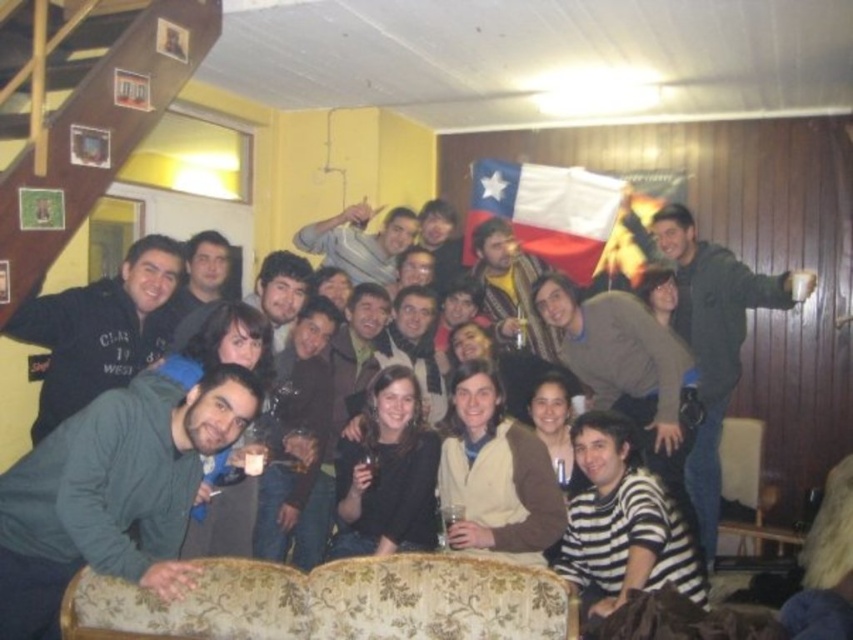
Does dark gray hoodie at center appear on the right side of striped cotton shirt at lower right?

In fact, dark gray hoodie at center is to the left of striped cotton shirt at lower right.

Between dark gray hoodie at center and striped cotton shirt at lower right, which one appears on the left side from the viewer's perspective?

Positioned to the left is dark gray hoodie at center.

What do you see at coordinates (113, 492) in the screenshot?
I see `dark gray hoodie at center` at bounding box center [113, 492].

Find the location of `dark gray hoodie at center`. dark gray hoodie at center is located at coordinates (113, 492).

Is dark gray hoodie at center below dark gray sweater at center?

Correct, dark gray hoodie at center is located below dark gray sweater at center.

Is point (163, 500) farther from camera compared to point (213, 266)?

No, it is in front of (213, 266).

You are a GUI agent. You are given a task and a screenshot of the screen. Output one action in this format:
    pyautogui.click(x=<x>, y=<y>)
    Task: Click on the dark gray hoodie at center
    
    Given the screenshot: What is the action you would take?
    coord(113,492)

In the scene shown: Who is more forward, (206, 435) or (97, 298)?

Point (206, 435) is in front.

Does point (181, 444) come behind point (129, 262)?

No, (181, 444) is in front of (129, 262).

This screenshot has height=640, width=853. Find the location of `dark gray hoodie at center`. dark gray hoodie at center is located at coordinates (113, 492).